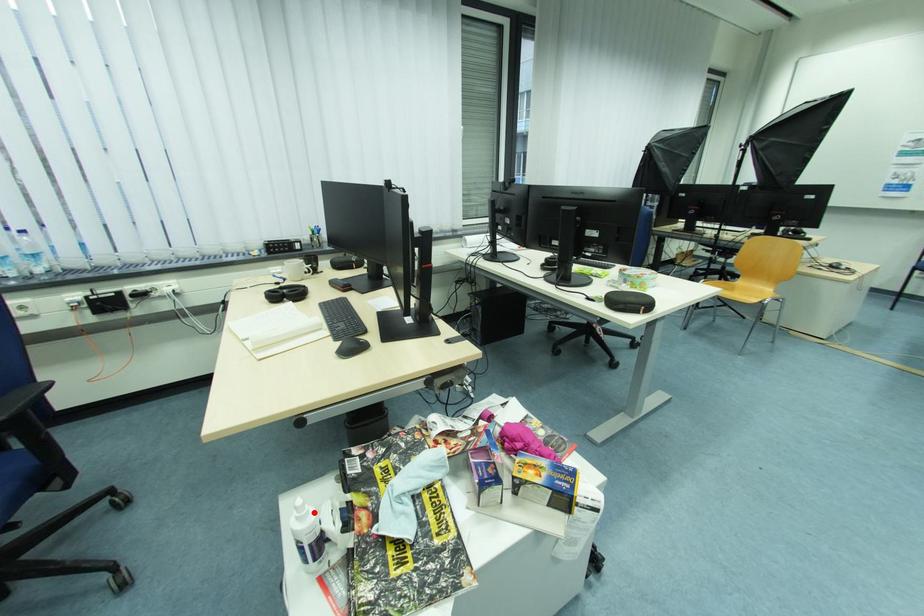
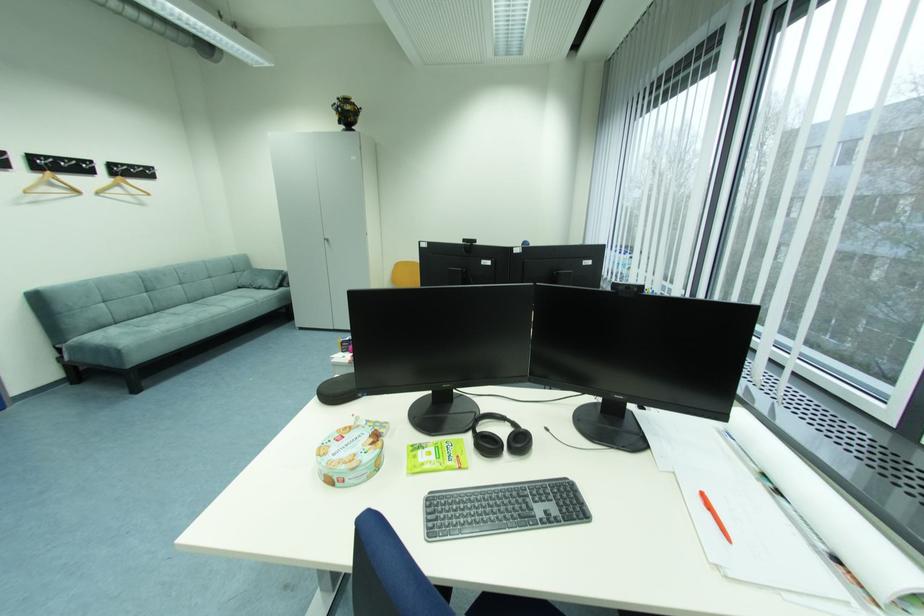
Question: I am providing you with two images of the same scene from different viewpoints. A red point is marked on the first image. At the location where the point appears in image 1, is it still visible in image 2?

Choices:
 (A) Yes
 (B) No

Answer: (B)